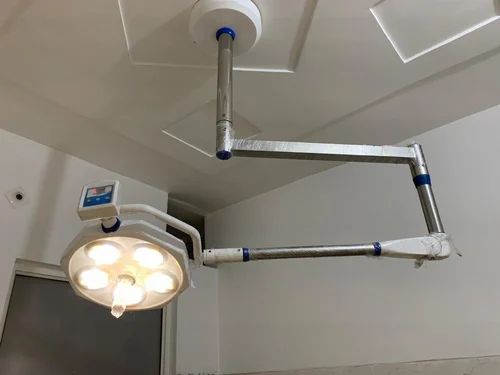
This screenshot has height=375, width=500. Find the location of `screen display`. screen display is located at coordinates (98, 190).